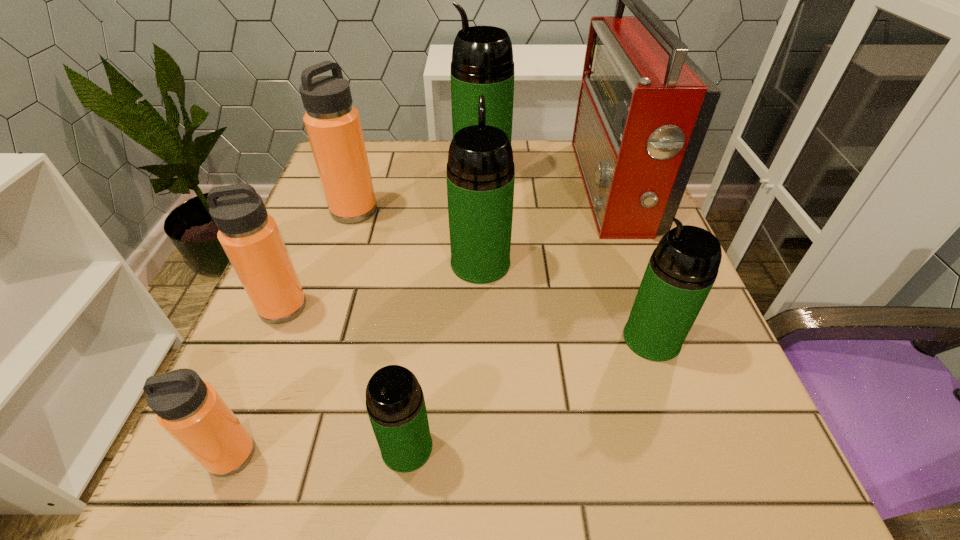
The height and width of the screenshot is (540, 960). I want to click on empty space between the nearest green thermos bottle and the second smallest orange thermos bottle, so click(x=345, y=377).

Where is `vacant space that's between the second biggest orange thermos bottle and the biggest green thermos bottle`? Image resolution: width=960 pixels, height=540 pixels. vacant space that's between the second biggest orange thermos bottle and the biggest green thermos bottle is located at coordinates (383, 240).

You are a GUI agent. You are given a task and a screenshot of the screen. Output one action in this format:
    pyautogui.click(x=<x>, y=<y>)
    Task: Click on the free spot between the biggest green thermos bottle and the smallest orange thermos bottle
    The width and height of the screenshot is (960, 540).
    Given the screenshot: What is the action you would take?
    pyautogui.click(x=357, y=314)

The height and width of the screenshot is (540, 960). I want to click on free area in between the radio receiver and the nearest green thermos bottle, so click(510, 318).

You are a GUI agent. You are given a task and a screenshot of the screen. Output one action in this format:
    pyautogui.click(x=<x>, y=<y>)
    Task: Click on the vacant point located between the second nearest green thermos bottle and the second biggest green thermos bottle
    This screenshot has height=540, width=960.
    Given the screenshot: What is the action you would take?
    pyautogui.click(x=566, y=301)

Identify the location of free space that is in between the farthest orange thermos bottle and the second biggest orange thermos bottle. (319, 259).

Locate an element on the screen. This screenshot has height=540, width=960. free space between the rightmost green thermos bottle and the smallest green thermos bottle is located at coordinates (529, 393).

Locate an element on the screen. This screenshot has height=540, width=960. vacant region between the radio receiver and the nearest orange thermos bottle is located at coordinates (421, 321).

The width and height of the screenshot is (960, 540). I want to click on the fifth closest object to the smallest orange thermos bottle, so click(x=682, y=269).

At what (x,y) coordinates should I click in order to perform the action: click on the sixth closest object to the radio receiver. Please return your answer as a coordinate pair (x, y). Looking at the image, I should click on (250, 237).